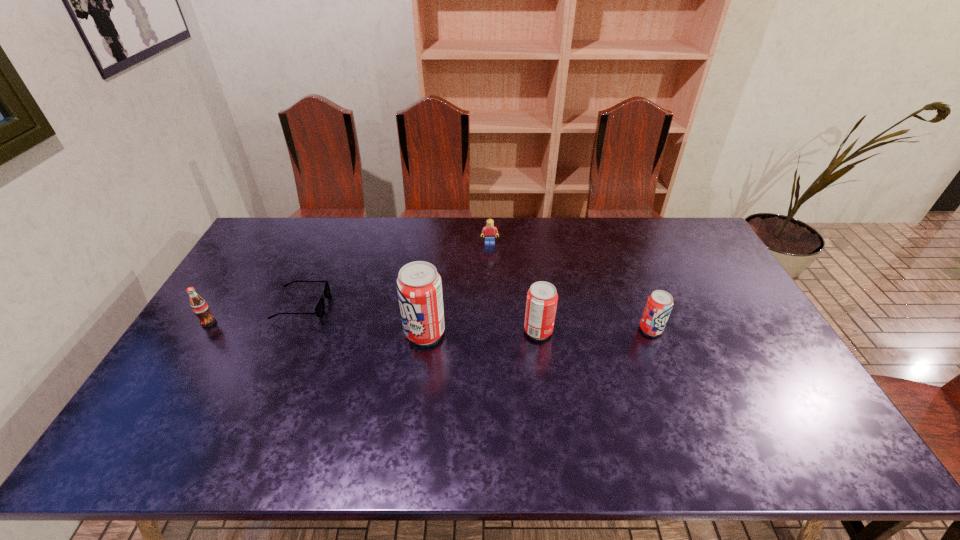
Find the location of a particular element. free space between the third object from right to left and the second soda from right to left is located at coordinates (514, 287).

You are a GUI agent. You are given a task and a screenshot of the screen. Output one action in this format:
    pyautogui.click(x=<x>, y=<y>)
    Task: Click on the free space between the third object from right to left and the rightmost object
    Image resolution: width=960 pixels, height=540 pixels.
    Given the screenshot: What is the action you would take?
    click(570, 286)

Locate an element on the screen. The height and width of the screenshot is (540, 960). free space between the second object from left to right and the farthest object is located at coordinates (396, 274).

Image resolution: width=960 pixels, height=540 pixels. In order to click on object that is the fifth closest one to the leftmost soda in this screenshot , I will do `click(660, 303)`.

Locate an element on the screen. object that is the closest to the rightmost soda is located at coordinates (541, 303).

Where is `the second closest soda to the second tallest soda`? the second closest soda to the second tallest soda is located at coordinates (660, 303).

Identify which soda is located as the third nearest to the rightmost object. Please provide its 2D coordinates. Your answer should be formatted as a tuple, i.e. [(x, y)], where the tuple contains the x and y coordinates of a point satisfying the conditions above.

[(199, 306)]

Find the location of a particular element. The height and width of the screenshot is (540, 960). vacant space that satisfies the following two spatial constraints: 1. on the front-facing side of the shortest object; 2. on the back side of the rightmost object is located at coordinates [292, 329].

The width and height of the screenshot is (960, 540). Find the location of `vacant space that satisfies the following two spatial constraints: 1. on the front-facing side of the rightmost object; 2. on the left side of the spectacles`. vacant space that satisfies the following two spatial constraints: 1. on the front-facing side of the rightmost object; 2. on the left side of the spectacles is located at coordinates 292,329.

Locate an element on the screen. free space that satisfies the following two spatial constraints: 1. on the front-facing side of the second object from left to right; 2. on the left side of the rightmost object is located at coordinates (292, 329).